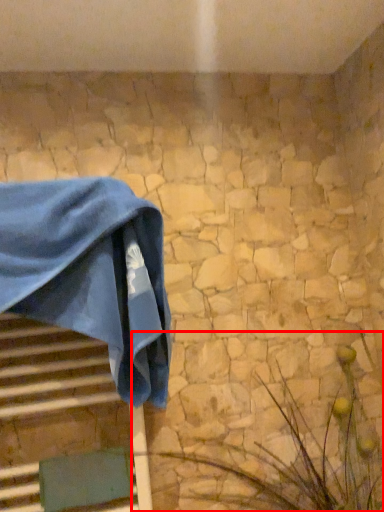
Question: From the image's perspective, where is plant (annotated by the red box) located relative to towel?

Choices:
 (A) above
 (B) below

Answer: (B)